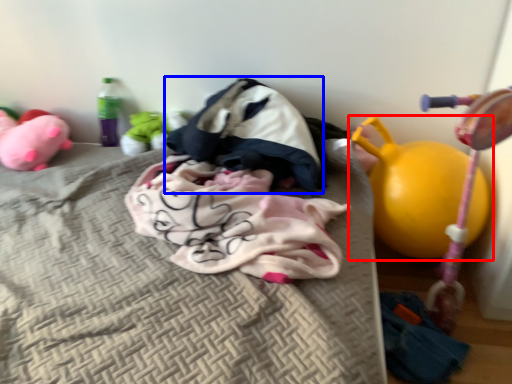
Question: Which object appears closest to the camera in this image, toy (highlighted by a red box) or sleeping bag (highlighted by a blue box)?

Choices:
 (A) toy
 (B) sleeping bag

Answer: (A)